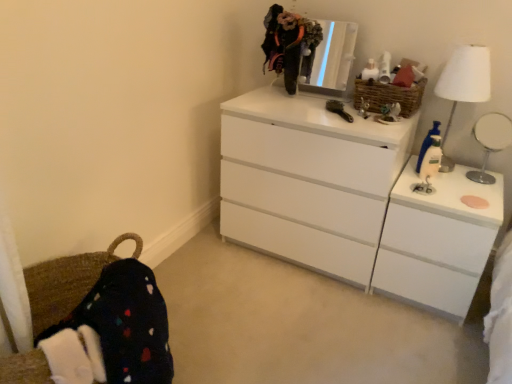
You are a GUI agent. You are given a task and a screenshot of the screen. Output one action in this format:
    pyautogui.click(x=<x>, y=<y>)
    Task: Click on the free space above white glossy file cabinet at right (from a real-world perspective)
    The width and height of the screenshot is (512, 384).
    Given the screenshot: What is the action you would take?
    pyautogui.click(x=454, y=182)